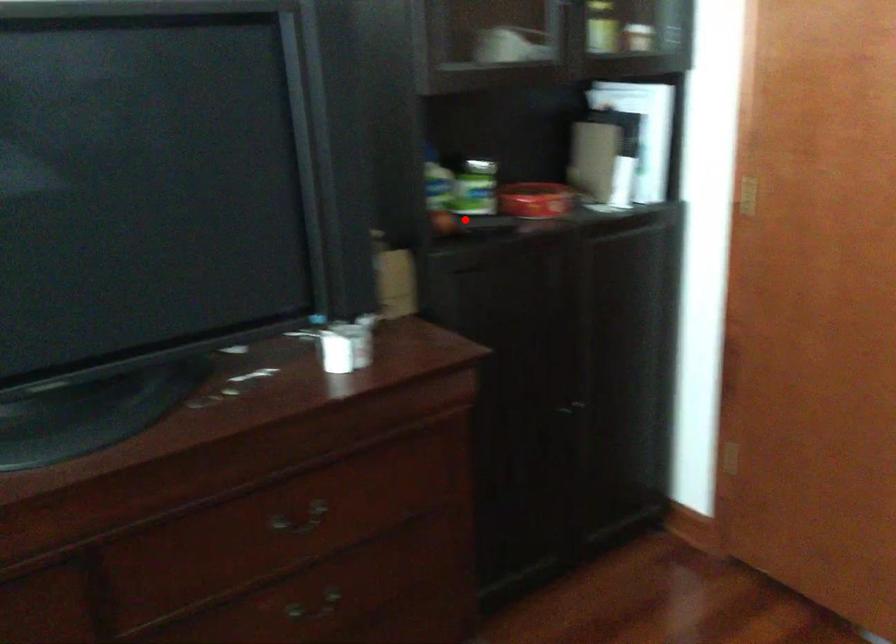
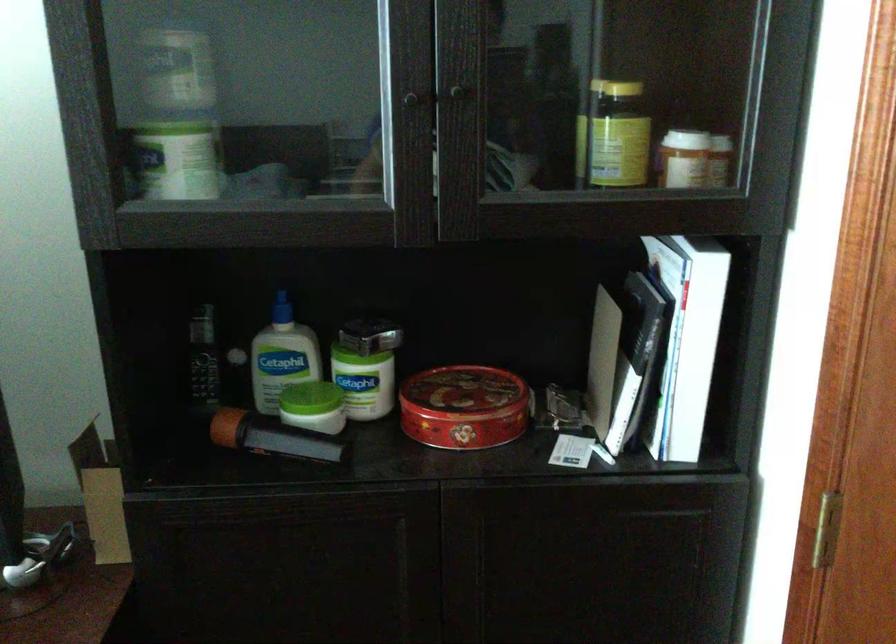
Where in the second image is the point corresponding to the highlighted location from the first image?

(268, 436)